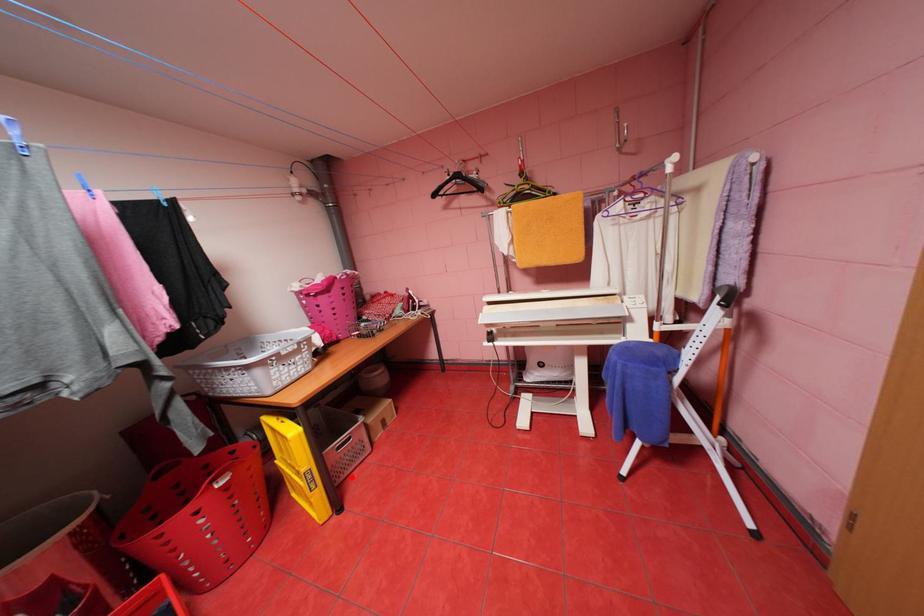
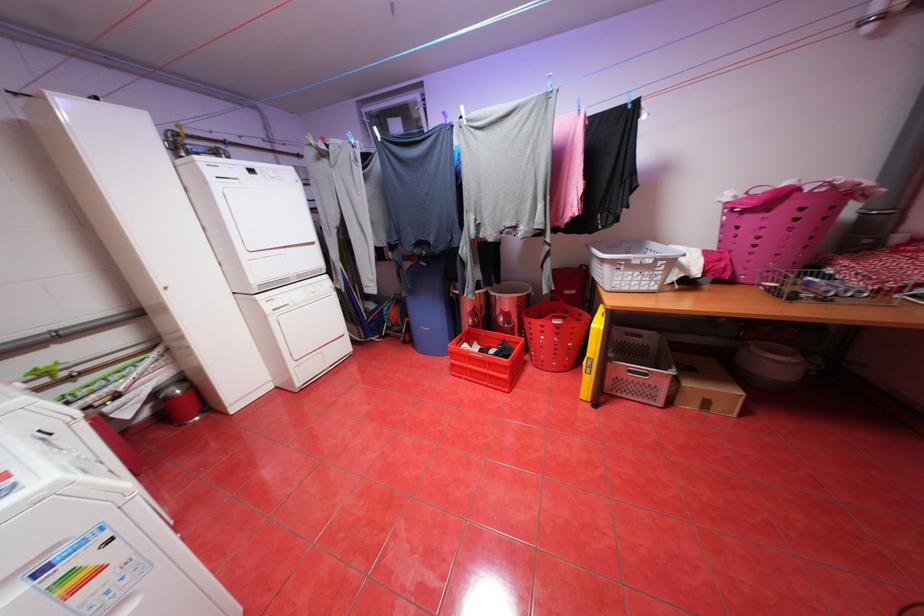
Locate, in the second image, the point that corresponds to the highlighted location in the first image.

(627, 394)